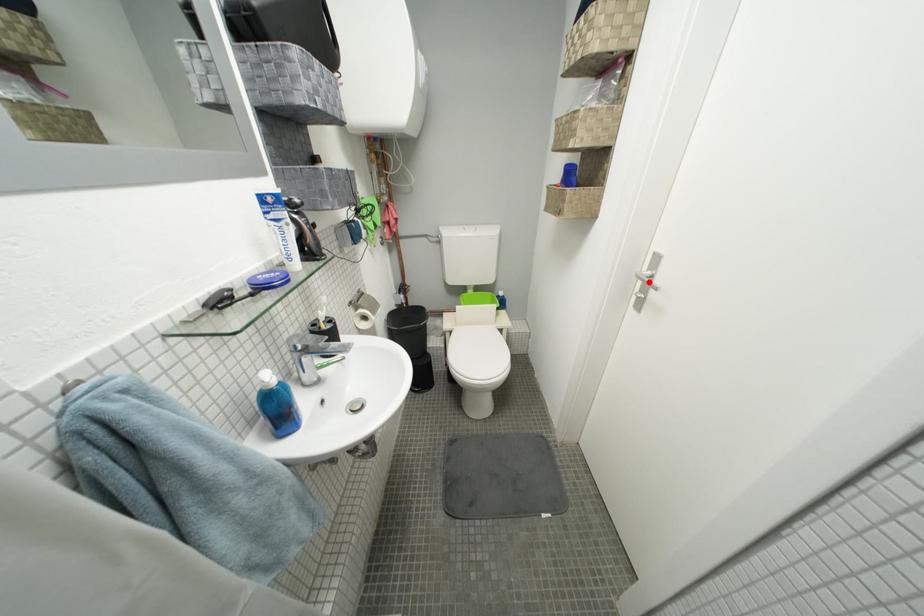
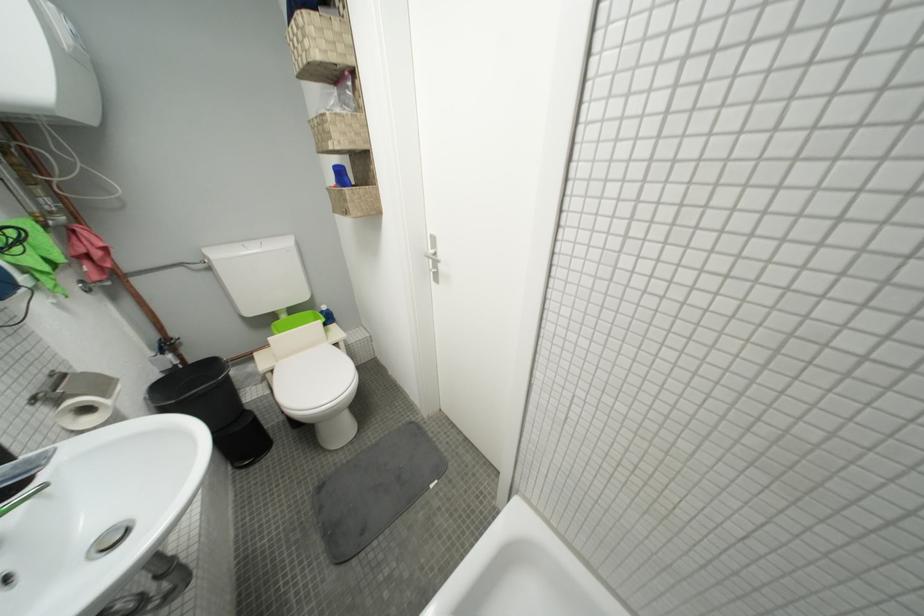
The point at the highlighted location is marked in the first image. Where is the corresponding point in the second image?

(438, 261)